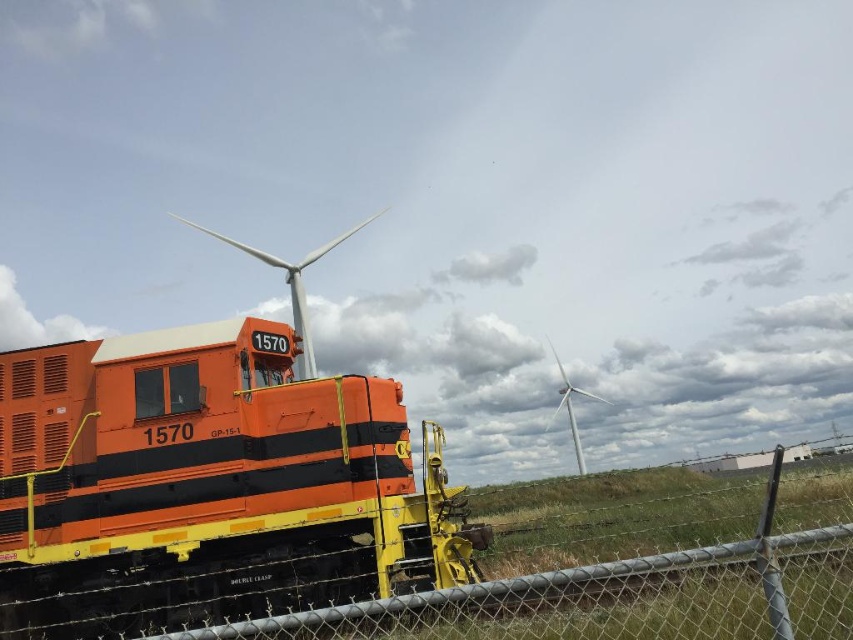
Who is higher up, metal chain-link fence at lower right or white metallic wind turbine at center?

metal chain-link fence at lower right

Between point (409, 636) and point (593, 394), which one is positioned in front?

Point (409, 636)

The image size is (853, 640). Find the location of `metal chain-link fence at lower right`. metal chain-link fence at lower right is located at coordinates pos(625,593).

This screenshot has width=853, height=640. Find the location of `metal chain-link fence at lower right`. metal chain-link fence at lower right is located at coordinates (625, 593).

Where is `metal chain-link fence at lower right`? The height and width of the screenshot is (640, 853). metal chain-link fence at lower right is located at coordinates (625, 593).

Who is shorter, metal chain-link fence at lower right or white matte wind turbine at upper center?

With less height is metal chain-link fence at lower right.

Identify the location of metal chain-link fence at lower right. This screenshot has width=853, height=640. (625, 593).

This screenshot has width=853, height=640. In order to click on metal chain-link fence at lower right in this screenshot , I will do (x=625, y=593).

Can you confirm if orange matte train at center is smaller than metal chain-link fence at lower right?

Incorrect, orange matte train at center is not smaller in size than metal chain-link fence at lower right.

Who is more forward, (x=223, y=529) or (x=815, y=540)?

Positioned in front is point (x=815, y=540).

The width and height of the screenshot is (853, 640). I want to click on orange matte train at center, so click(x=210, y=481).